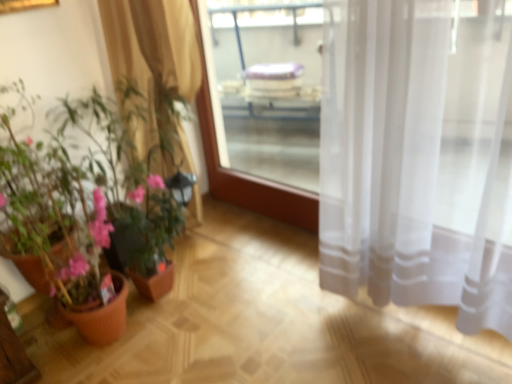
Question: Does beige sheer curtain at left appear on the left side of transparent glass window screen at center?

Choices:
 (A) no
 (B) yes

Answer: (B)

Question: From a real-world perspective, does beige sheer curtain at left sit lower than transparent glass window screen at center?

Choices:
 (A) yes
 (B) no

Answer: (B)

Question: Is beige sheer curtain at left in contact with transparent glass window screen at center?

Choices:
 (A) no
 (B) yes

Answer: (A)

Question: Considering the relative sizes of beige sheer curtain at left and transparent glass window screen at center in the image provided, is beige sheer curtain at left bigger than transparent glass window screen at center?

Choices:
 (A) yes
 (B) no

Answer: (A)

Question: Is transparent glass window screen at center inside beige sheer curtain at left?

Choices:
 (A) yes
 (B) no

Answer: (B)

Question: Considering the positions of beige sheer curtain at left and terracotta pot plant at left in the image, is beige sheer curtain at left taller or shorter than terracotta pot plant at left?

Choices:
 (A) tall
 (B) short

Answer: (B)

Question: Visually, is beige sheer curtain at left positioned to the left or to the right of terracotta pot plant at left?

Choices:
 (A) right
 (B) left

Answer: (A)

Question: Is point (161, 33) positioned closer to the camera than point (112, 125)?

Choices:
 (A) farther
 (B) closer

Answer: (B)

Question: Choose the correct answer: Is beige sheer curtain at left inside terracotta pot plant at left or outside it?

Choices:
 (A) inside
 (B) outside

Answer: (B)

Question: Is terracotta pot plant at left in front of or behind beige sheer curtain at left in the image?

Choices:
 (A) behind
 (B) front

Answer: (B)

Question: Considering the positions of point (119, 269) and point (187, 67), is point (119, 269) closer or farther from the camera than point (187, 67)?

Choices:
 (A) farther
 (B) closer

Answer: (A)

Question: Considering the positions of terracotta pot plant at left and beige sheer curtain at left in the image, is terracotta pot plant at left wider or thinner than beige sheer curtain at left?

Choices:
 (A) wide
 (B) thin

Answer: (A)

Question: Looking at the image, does terracotta pot plant at left seem bigger or smaller compared to beige sheer curtain at left?

Choices:
 (A) small
 (B) big

Answer: (B)

Question: In terms of width, does beige sheer curtain at left look wider or thinner when compared to transparent glass window screen at center?

Choices:
 (A) wide
 (B) thin

Answer: (A)

Question: From a real-world perspective, relative to transparent glass window screen at center, is beige sheer curtain at left vertically above or below?

Choices:
 (A) below
 (B) above

Answer: (B)